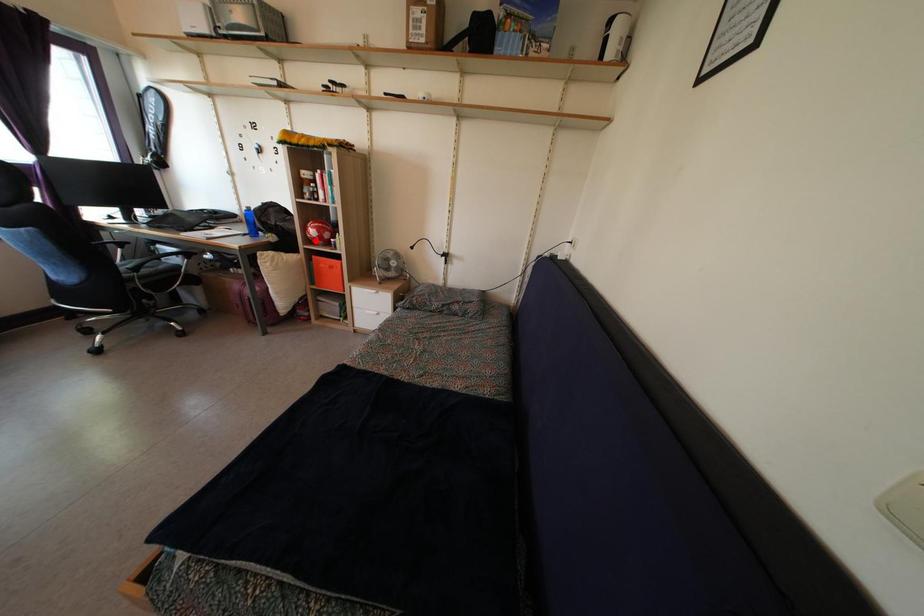
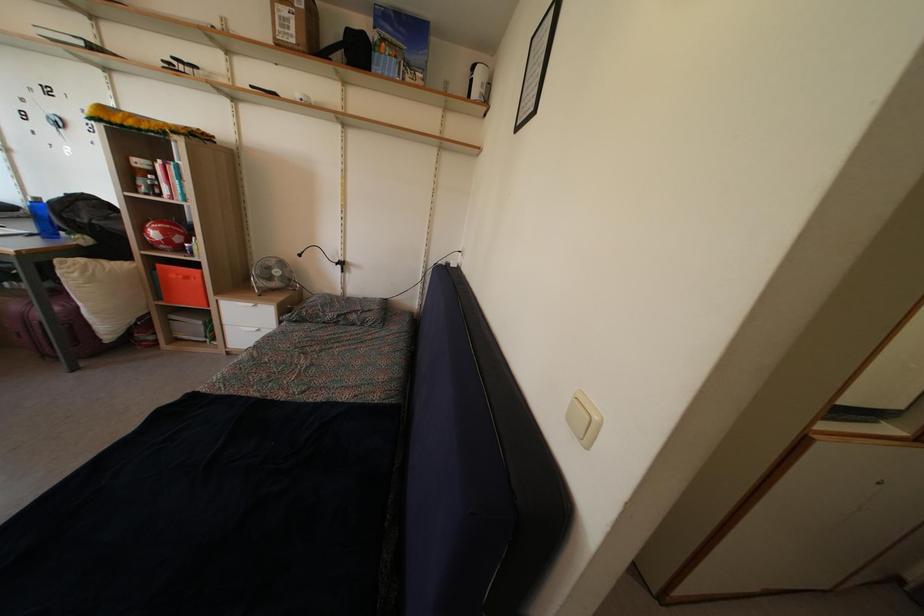
Where in the second image is the point corresponding to the highlighted location from the first image?

(157, 243)